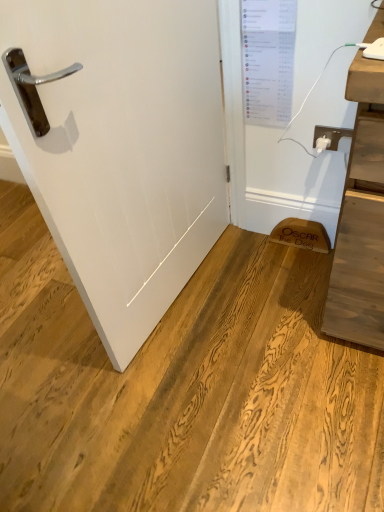
Question: Is white matte door at center turned away from white plastic plug at upper right?

Choices:
 (A) yes
 (B) no

Answer: (B)

Question: Does white matte door at center have a lesser height compared to white plastic plug at upper right?

Choices:
 (A) yes
 (B) no

Answer: (B)

Question: Is white matte door at center closer to the viewer compared to white plastic plug at upper right?

Choices:
 (A) no
 (B) yes

Answer: (B)

Question: Does white matte door at center appear on the left side of white plastic plug at upper right?

Choices:
 (A) no
 (B) yes

Answer: (B)

Question: Can we say white matte door at center lies outside white plastic plug at upper right?

Choices:
 (A) yes
 (B) no

Answer: (A)

Question: Can you confirm if white matte door at center is smaller than white plastic plug at upper right?

Choices:
 (A) no
 (B) yes

Answer: (A)

Question: Is white plastic plug at upper right further to camera compared to white matte door at center?

Choices:
 (A) yes
 (B) no

Answer: (A)

Question: Is white plastic plug at upper right turned away from white matte door at center?

Choices:
 (A) no
 (B) yes

Answer: (A)

Question: Is white plastic plug at upper right far from white matte door at center?

Choices:
 (A) no
 (B) yes

Answer: (A)

Question: From the image's perspective, would you say white plastic plug at upper right is shown under white matte door at center?

Choices:
 (A) no
 (B) yes

Answer: (A)

Question: Is white plastic plug at upper right positioned beyond the bounds of white matte door at center?

Choices:
 (A) no
 (B) yes

Answer: (B)

Question: From a real-world perspective, is white plastic plug at upper right under white matte door at center?

Choices:
 (A) no
 (B) yes

Answer: (B)

Question: Is white matte door at center taller or shorter than white plastic plug at upper right?

Choices:
 (A) tall
 (B) short

Answer: (A)